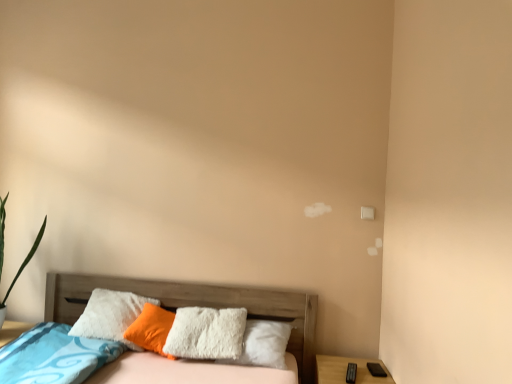
Question: Can you confirm if white fluffy pillow at center is thinner than wooden bed at lower left?

Choices:
 (A) no
 (B) yes

Answer: (B)

Question: From the image's perspective, is white fluffy pillow at center on top of wooden bed at lower left?

Choices:
 (A) no
 (B) yes

Answer: (B)

Question: From a real-world perspective, does white fluffy pillow at center sit lower than wooden bed at lower left?

Choices:
 (A) yes
 (B) no

Answer: (B)

Question: Does white fluffy pillow at center have a lesser height compared to wooden bed at lower left?

Choices:
 (A) yes
 (B) no

Answer: (A)

Question: Does white fluffy pillow at center have a larger size compared to wooden bed at lower left?

Choices:
 (A) yes
 (B) no

Answer: (B)

Question: Is white fluffy pillow at center bigger or smaller than wooden nightstand at lower right?

Choices:
 (A) small
 (B) big

Answer: (A)

Question: From their relative heights in the image, would you say white fluffy pillow at center is taller or shorter than wooden nightstand at lower right?

Choices:
 (A) tall
 (B) short

Answer: (A)

Question: Looking at their shapes, would you say white fluffy pillow at center is wider or thinner than wooden nightstand at lower right?

Choices:
 (A) thin
 (B) wide

Answer: (A)

Question: Relative to wooden nightstand at lower right, is white fluffy pillow at center in front or behind?

Choices:
 (A) behind
 (B) front

Answer: (A)

Question: Is white fluffy pillow at center in front of or behind wooden bed at lower left in the image?

Choices:
 (A) behind
 (B) front

Answer: (A)

Question: Is white fluffy pillow at center inside or outside of wooden bed at lower left?

Choices:
 (A) outside
 (B) inside

Answer: (B)

Question: In terms of height, does white fluffy pillow at center look taller or shorter compared to wooden bed at lower left?

Choices:
 (A) tall
 (B) short

Answer: (B)

Question: Is point (159, 344) closer or farther from the camera than point (70, 302)?

Choices:
 (A) closer
 (B) farther

Answer: (A)

Question: In the image, is wooden bed at lower left positioned in front of or behind white fluffy pillow at center?

Choices:
 (A) behind
 (B) front

Answer: (B)

Question: Looking at their shapes, would you say wooden bed at lower left is wider or thinner than white fluffy pillow at center?

Choices:
 (A) thin
 (B) wide

Answer: (B)